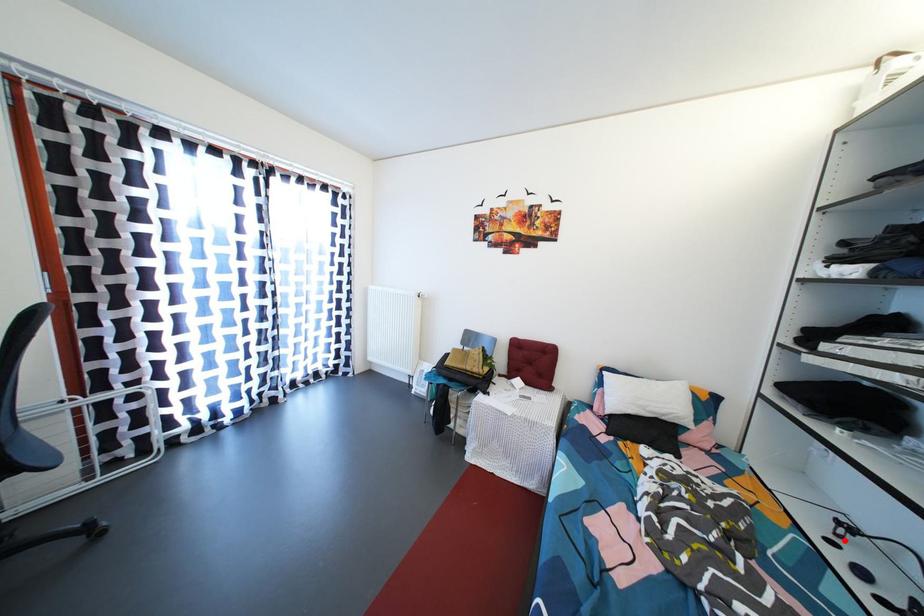
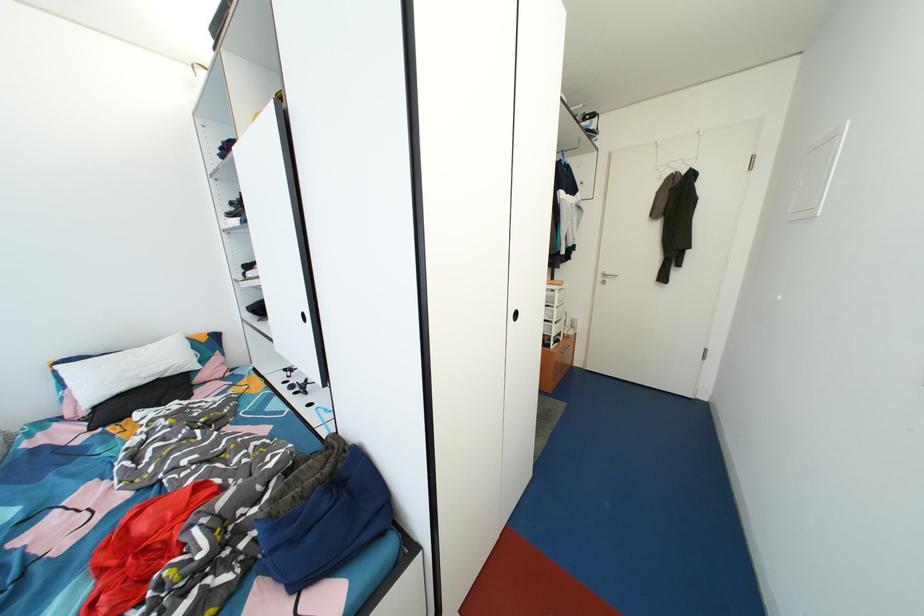
Question: I am providing you with two images of the same scene from different viewpoints. In image1, a red point is highlighted. Considering the same 3D point in image2, which of the following is correct?

Choices:
 (A) It is closer
 (B) It is farther

Answer: (B)